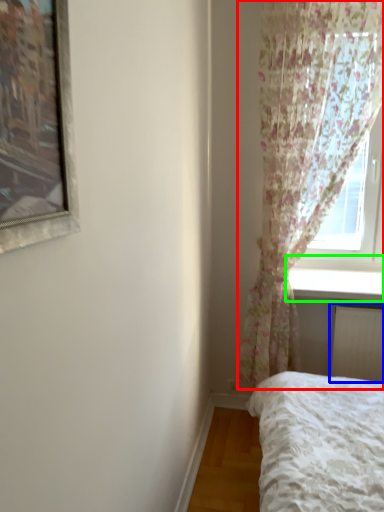
Question: Which is farther away from curtain (highlighted by a red box)? radiator (highlighted by a blue box) or window sill (highlighted by a green box)?

Choices:
 (A) radiator
 (B) window sill

Answer: (A)